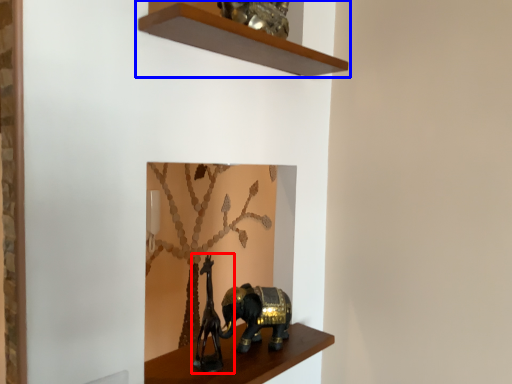
Question: Which of the following is the farthest to the observer, animal sculpture (highlighted by a red box) or shelf (highlighted by a blue box)?

Choices:
 (A) animal sculpture
 (B) shelf

Answer: (A)